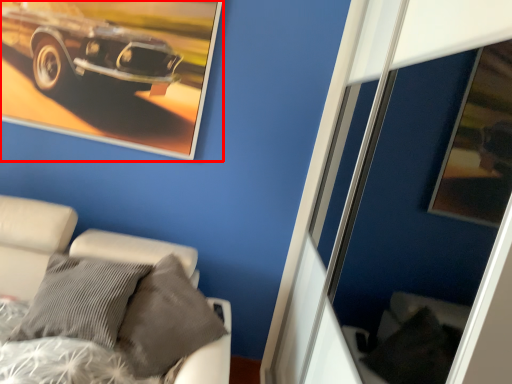
Question: In this image, where is picture frame (annotated by the red box) located relative to furniture?

Choices:
 (A) left
 (B) right

Answer: (A)